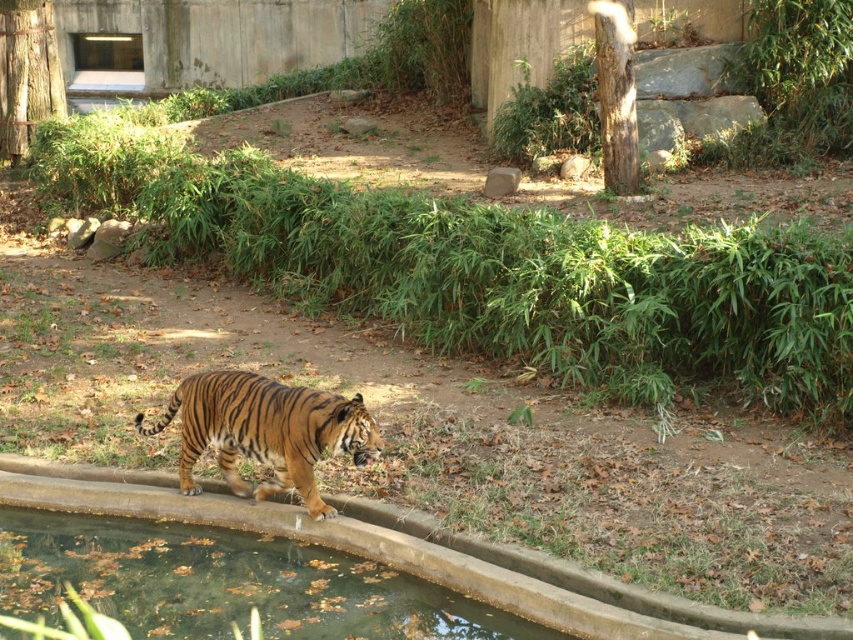
Question: Which object is closer to the camera taking this photo?

Choices:
 (A) orange-brown striped tiger at center
 (B) clear glass puddle at lower left

Answer: (B)

Question: Does clear glass puddle at lower left appear on the left side of orange-brown striped tiger at center?

Choices:
 (A) no
 (B) yes

Answer: (B)

Question: Which object is closer to the camera taking this photo?

Choices:
 (A) clear glass puddle at lower left
 (B) orange-brown striped tiger at center

Answer: (A)

Question: Can you confirm if clear glass puddle at lower left is positioned to the right of orange-brown striped tiger at center?

Choices:
 (A) yes
 (B) no

Answer: (B)

Question: Can you confirm if clear glass puddle at lower left is positioned above orange-brown striped tiger at center?

Choices:
 (A) yes
 (B) no

Answer: (B)